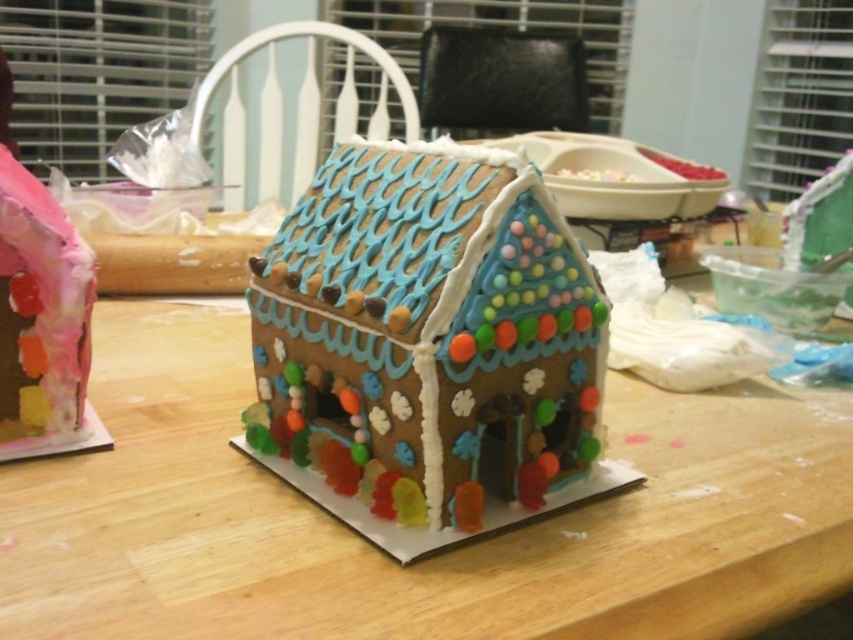
Question: Can you confirm if wooden table at center is smaller than glossy gingerbread house at center?

Choices:
 (A) no
 (B) yes

Answer: (A)

Question: Which point is closer to the camera?

Choices:
 (A) (515, 216)
 (B) (228, 368)

Answer: (A)

Question: Which point is closer to the camera taking this photo?

Choices:
 (A) (366, 330)
 (B) (345, 568)

Answer: (B)

Question: Can you confirm if wooden table at center is positioned above glossy gingerbread house at center?

Choices:
 (A) no
 (B) yes

Answer: (A)

Question: Which point is farther to the camera?

Choices:
 (A) wooden table at center
 (B) glossy gingerbread house at center

Answer: (B)

Question: Is wooden table at center to the left of glossy gingerbread house at center from the viewer's perspective?

Choices:
 (A) no
 (B) yes

Answer: (B)